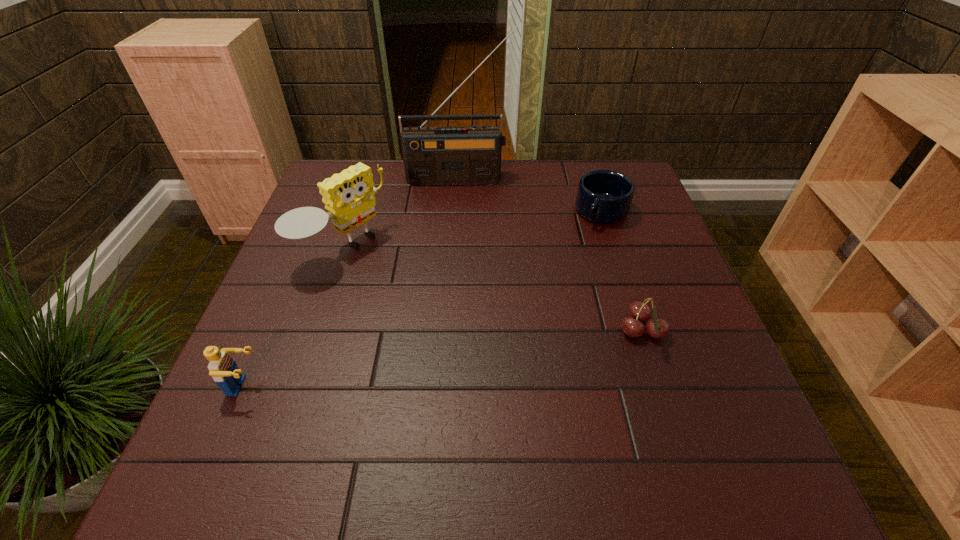
Find the location of a particular element. blank region between the second nearest object and the sponge is located at coordinates (492, 289).

Locate an element on the screen. The height and width of the screenshot is (540, 960). free space between the mug and the sponge is located at coordinates (472, 230).

Choose which object is the fourth nearest neighbor to the mug. Please provide its 2D coordinates. Your answer should be formatted as a tuple, i.e. [(x, y)], where the tuple contains the x and y coordinates of a point satisfying the conditions above.

[(223, 369)]

Locate which object is the fourth closest to the radio receiver. Please provide its 2D coordinates. Your answer should be formatted as a tuple, i.e. [(x, y)], where the tuple contains the x and y coordinates of a point satisfying the conditions above.

[(223, 369)]

Locate an element on the screen. blank space that satisfies the following two spatial constraints: 1. on the front side of the tallest object; 2. on the leaves of the fourth farthest object is located at coordinates (449, 331).

The width and height of the screenshot is (960, 540). I want to click on free space that satisfies the following two spatial constraints: 1. on the front side of the fourth shortest object; 2. on the leaves of the fourth farthest object, so (315, 331).

I want to click on vacant region that satisfies the following two spatial constraints: 1. on the front side of the radio receiver; 2. on the leaves of the cherry, so click(449, 331).